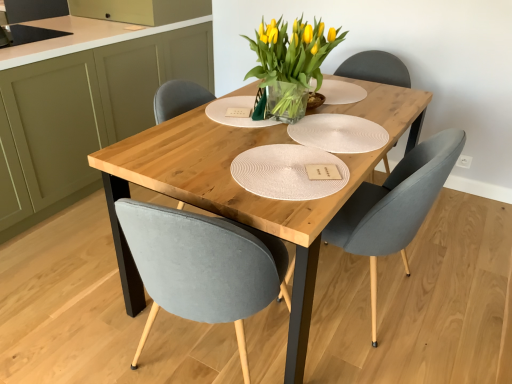
Question: Is there a large distance between white textured paper plate at center and velvet grey chair at center?

Choices:
 (A) yes
 (B) no

Answer: (B)

Question: Is white textured paper plate at center further to the viewer compared to velvet grey chair at center?

Choices:
 (A) yes
 (B) no

Answer: (A)

Question: From a real-world perspective, is white textured paper plate at center on velvet grey chair at center?

Choices:
 (A) no
 (B) yes

Answer: (B)

Question: From the image's perspective, would you say white textured paper plate at center is positioned over velvet grey chair at center?

Choices:
 (A) yes
 (B) no

Answer: (A)

Question: From the image's perspective, is white textured paper plate at center below velvet grey chair at center?

Choices:
 (A) yes
 (B) no

Answer: (B)

Question: Is white textured paper plate at center outside of velvet grey chair at center?

Choices:
 (A) no
 (B) yes

Answer: (A)

Question: Is white textured paper plate at center looking in the opposite direction of translucent glass vase at center?

Choices:
 (A) no
 (B) yes

Answer: (A)

Question: Does white textured paper plate at center appear on the left side of translucent glass vase at center?

Choices:
 (A) yes
 (B) no

Answer: (B)

Question: From a real-world perspective, is white textured paper plate at center located beneath translucent glass vase at center?

Choices:
 (A) no
 (B) yes

Answer: (B)

Question: Is the depth of white textured paper plate at center greater than that of translucent glass vase at center?

Choices:
 (A) no
 (B) yes

Answer: (B)

Question: Considering the relative sizes of white textured paper plate at center and translucent glass vase at center in the image provided, is white textured paper plate at center smaller than translucent glass vase at center?

Choices:
 (A) yes
 (B) no

Answer: (A)

Question: Is white textured paper plate at center facing towards translucent glass vase at center?

Choices:
 (A) no
 (B) yes

Answer: (A)

Question: Could you tell me if velvet grey chair at center is facing matte olive green cabinet at left?

Choices:
 (A) no
 (B) yes

Answer: (B)